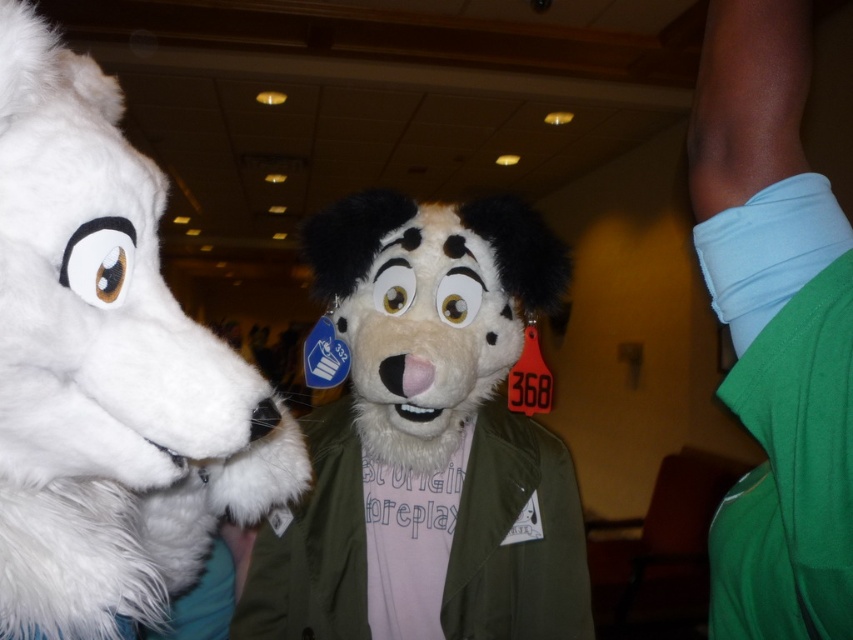
Consider the image. You are a photographer at an event and need to capture a photo of the white furry head at left and the green fabric shirt at right. The camera you are using has a minimum focusing distance of 20 inches. Will you be able to take a clear photo of both subjects without moving the camera or the subjects?

The white furry head at left and green fabric shirt at right are 19.75 inches apart, which is less than the camera minimum focusing distance of 20 inches. Therefore, you won not be able to take a clear photo of both subjects without moving the camera or the subjects.

You are a photographer at the event and want to capture both the white furry head at left and the fuzzy tan dog at center in a single shot. Based on their positions, which one is higher in the frame?

The white furry head at left is positioned over the fuzzy tan dog at center, so it is higher in the frame.

You are a photographer trying to capture a group photo of the white furry head at left and the fuzzy tan dog at center. The minimum distance required for your camera to focus properly is 12 inches. Based on the scene, will you be able to take a clear photo of both subjects at the same time?

The white furry head at left and the fuzzy tan dog at center are 11.34 inches apart from each other, which is less than the 12 inches required for the camera to focus properly. Therefore, you will not be able to take a clear photo of both subjects at the same time.